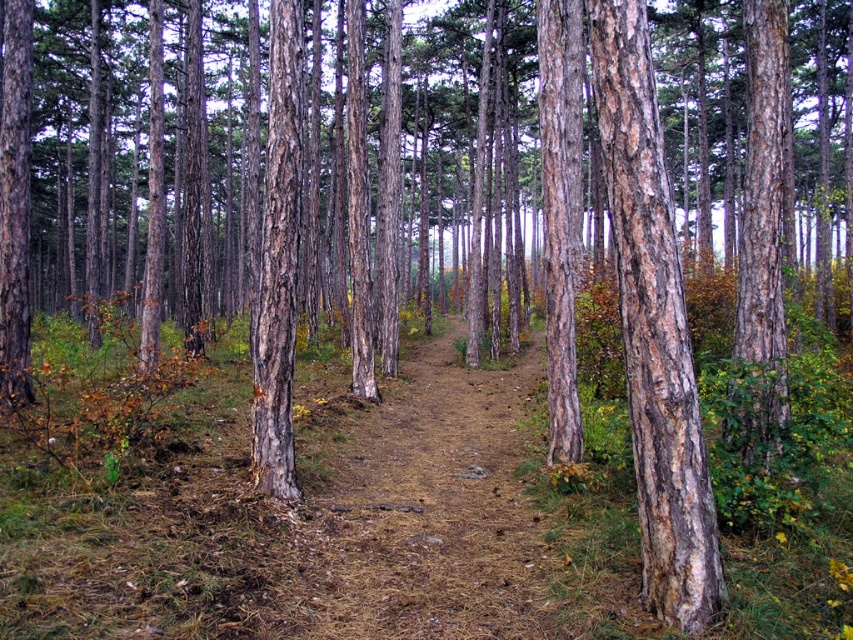
Question: Is brown dirt trail at center bigger than smooth brown bark at center?

Choices:
 (A) yes
 (B) no

Answer: (A)

Question: Which object appears farthest from the camera in this image?

Choices:
 (A) smooth brown bark at center
 (B) brown dirt trail at center

Answer: (B)

Question: Can you confirm if brown dirt trail at center is bigger than smooth brown bark at center?

Choices:
 (A) no
 (B) yes

Answer: (B)

Question: Where is brown dirt trail at center located in relation to smooth brown bark at center in the image?

Choices:
 (A) right
 (B) left

Answer: (B)

Question: Which point is farther to the camera?

Choices:
 (A) brown dirt trail at center
 (B) smooth brown bark at center

Answer: (A)